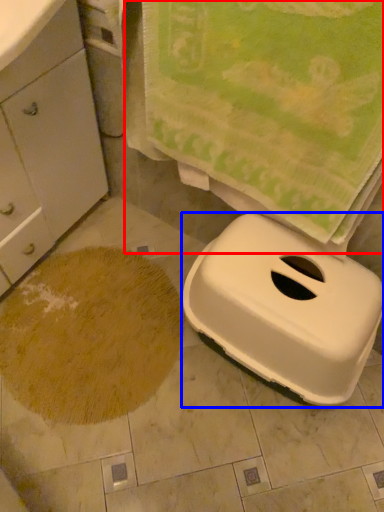
Question: Which object is further to the camera taking this photo, beach towel (highlighted by a red box) or appliance (highlighted by a blue box)?

Choices:
 (A) beach towel
 (B) appliance

Answer: (B)